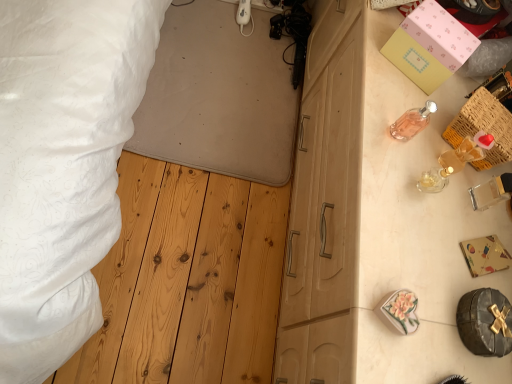
This screenshot has height=384, width=512. What do you see at coordinates (63, 165) in the screenshot?
I see `white textured bed at upper left` at bounding box center [63, 165].

Describe the element at coordinates (440, 34) in the screenshot. This screenshot has width=512, height=384. I see `pink matte box at upper right, the second box in the front-to-back sequence` at that location.

What is the approximate height of pink matte box at upper right, the 1th box when ordered from back to front?

5.49 inches.

At what (x,y) coordinates should I click in order to perform the action: click on gold foil gift box at right, which ranks as the second box in top-to-bottom order. Please return your answer as a coordinate pair (x, y). The height and width of the screenshot is (384, 512). Looking at the image, I should click on (485, 255).

Measure the distance between point (507,128) and camera.

The distance of point (507,128) from camera is 96.40 centimeters.

At what (x,y) coordinates should I click in order to perform the action: click on white textured bed at upper left. Please return your answer as a coordinate pair (x, y). The width and height of the screenshot is (512, 384). Looking at the image, I should click on (63, 165).

Can you see woven wood crate at upper right touching pink matte box at upper right, acting as the 1th box starting from the top?

No, woven wood crate at upper right is not in contact with pink matte box at upper right, acting as the 1th box starting from the top.

Is woven wood crate at upper right thinner than pink matte box at upper right, acting as the 1th box starting from the top?

Yes, woven wood crate at upper right is thinner than pink matte box at upper right, acting as the 1th box starting from the top.

Where is `box above the woven wood crate at upper right (from the image's perspective)`? box above the woven wood crate at upper right (from the image's perspective) is located at coordinates (440, 34).

Considering the positions of points (494, 137) and (438, 30), is point (494, 137) farther from camera compared to point (438, 30)?

No, it is in front of (438, 30).

From their relative heights in the image, would you say woven wood crate at upper right is taller or shorter than gold foil gift box at right, marked as the first box in a bottom-to-top arrangement?

woven wood crate at upper right is taller than gold foil gift box at right, marked as the first box in a bottom-to-top arrangement.

Is woven wood crate at upper right spatially inside gold foil gift box at right, which ranks as the second box in top-to-bottom order, or outside of it?

woven wood crate at upper right is not inside gold foil gift box at right, which ranks as the second box in top-to-bottom order, it's outside.

From the image's perspective, which one is positioned higher, woven wood crate at upper right or gold foil gift box at right, which ranks as the second box in top-to-bottom order?

From the image's view, woven wood crate at upper right is above.

Considering the relative positions of woven wood crate at upper right and gold foil gift box at right, positioned as the first box in front-to-back order, in the image provided, is woven wood crate at upper right to the right of gold foil gift box at right, positioned as the first box in front-to-back order, from the viewer's perspective?

Indeed, woven wood crate at upper right is positioned on the right side of gold foil gift box at right, positioned as the first box in front-to-back order.

From a real-world perspective, which object rests below the other?

white textured bed at upper left.

Which is correct: white textured bed at upper left is inside woven wood crate at upper right, or outside of it?

white textured bed at upper left is spatially situated outside woven wood crate at upper right.

From the image's perspective, is white textured bed at upper left under woven wood crate at upper right?

No.

Which of these two, white textured bed at upper left or woven wood crate at upper right, is thinner?

With smaller width is woven wood crate at upper right.

At what (x,y) coordinates should I click in order to perform the action: click on toiletry lying in front of the white textured bed at upper left. Please return your answer as a coordinate pair (x, y). Looking at the image, I should click on (412, 122).

Is white textured bed at upper left thinner than pink glass perfume at upper right?

In fact, white textured bed at upper left might be wider than pink glass perfume at upper right.

Looking at this image, how different are the orientations of white textured bed at upper left and pink glass perfume at upper right in degrees?

91.7 degrees.

From the picture: Is white textured bed at upper left in front of or behind pink glass perfume at upper right in the image?

In the image, white textured bed at upper left appears behind pink glass perfume at upper right.

Where is `box beneath the pink matte box at upper right, the 1th box when ordered from back to front (from a real-world perspective)`? The width and height of the screenshot is (512, 384). box beneath the pink matte box at upper right, the 1th box when ordered from back to front (from a real-world perspective) is located at coordinates (485, 255).

How much distance is there between pink matte box at upper right, the second box in the front-to-back sequence, and gold foil gift box at right, which ranks as the second box in top-to-bottom order?

pink matte box at upper right, the second box in the front-to-back sequence, is 18.49 inches away from gold foil gift box at right, which ranks as the second box in top-to-bottom order.

Between pink matte box at upper right, the second box in the front-to-back sequence, and gold foil gift box at right, the 2th box viewed from the back, which one has smaller width?

gold foil gift box at right, the 2th box viewed from the back.

How different are the orientations of pink glass perfume at upper right and gold foil gift box at right, marked as the first box in a bottom-to-top arrangement, in degrees?

19.7 degrees separate the facing orientations of pink glass perfume at upper right and gold foil gift box at right, marked as the first box in a bottom-to-top arrangement.

Is pink glass perfume at upper right located outside gold foil gift box at right, which ranks as the second box in top-to-bottom order?

Yes, pink glass perfume at upper right is not within gold foil gift box at right, which ranks as the second box in top-to-bottom order.

Is point (430, 109) behind point (479, 248)?

No, it is not.

Is white textured bed at upper left beside pink matte box at upper right, acting as the 1th box starting from the top?

There is a gap between white textured bed at upper left and pink matte box at upper right, acting as the 1th box starting from the top.

In terms of width, does white textured bed at upper left look wider or thinner when compared to pink matte box at upper right, the second box positioned from the bottom?

white textured bed at upper left is wider than pink matte box at upper right, the second box positioned from the bottom.

Does white textured bed at upper left have a lesser height compared to pink matte box at upper right, the 1th box when ordered from back to front?

Correct, white textured bed at upper left is not as tall as pink matte box at upper right, the 1th box when ordered from back to front.

Image resolution: width=512 pixels, height=384 pixels. Find the location of `crate on the left of pink matte box at upper right, acting as the 1th box starting from the top`. crate on the left of pink matte box at upper right, acting as the 1th box starting from the top is located at coordinates (483, 127).

At what (x,y) coordinates should I click in order to perform the action: click on box in front of the woven wood crate at upper right. Please return your answer as a coordinate pair (x, y). This screenshot has height=384, width=512. Looking at the image, I should click on (485, 255).

Based on their spatial positions, is white textured bed at upper left or woven wood crate at upper right further from pink matte box at upper right, the 1th box when ordered from back to front?

white textured bed at upper left is positioned further to the anchor pink matte box at upper right, the 1th box when ordered from back to front.

When comparing their distances from pink matte box at upper right, the 1th box when ordered from back to front, does gold foil gift box at right, positioned as the first box in front-to-back order, or woven wood crate at upper right seem further?

gold foil gift box at right, positioned as the first box in front-to-back order, lies further to pink matte box at upper right, the 1th box when ordered from back to front, than the other object.

Considering their positions, is white textured bed at upper left positioned further to woven wood crate at upper right than pink matte box at upper right, the second box positioned from the bottom?

The object further to woven wood crate at upper right is white textured bed at upper left.

From the image, which object appears to be farther from pink glass perfume at upper right, white textured bed at upper left or gold foil gift box at right, which ranks as the second box in top-to-bottom order?

white textured bed at upper left is positioned further to the anchor pink glass perfume at upper right.

Estimate the real-world distances between objects in this image. Which object is closer to gold foil gift box at right, marked as the first box in a bottom-to-top arrangement, pink glass perfume at upper right or pink matte box at upper right, the second box positioned from the bottom?

Among the two, pink glass perfume at upper right is located nearer to gold foil gift box at right, marked as the first box in a bottom-to-top arrangement.

From the image, which object appears to be nearer to white textured bed at upper left, woven wood crate at upper right or gold foil gift box at right, which ranks as the second box in top-to-bottom order?

woven wood crate at upper right.

Estimate the real-world distances between objects in this image. Which object is closer to pink matte box at upper right, the second box in the front-to-back sequence, woven wood crate at upper right or white textured bed at upper left?

The object closer to pink matte box at upper right, the second box in the front-to-back sequence, is woven wood crate at upper right.

Looking at the image, which one is located further to gold foil gift box at right, which ranks as the second box in top-to-bottom order, pink matte box at upper right, the second box positioned from the bottom, or pink glass perfume at upper right?

Based on the image, pink matte box at upper right, the second box positioned from the bottom, appears to be further to gold foil gift box at right, which ranks as the second box in top-to-bottom order.

The height and width of the screenshot is (384, 512). Identify the location of toiletry between white textured bed at upper left and pink matte box at upper right, the 1th box when ordered from back to front, from left to right. (412, 122).

At what (x,y) coordinates should I click in order to perform the action: click on crate between pink glass perfume at upper right and gold foil gift box at right, marked as the first box in a bottom-to-top arrangement, vertically. Please return your answer as a coordinate pair (x, y). This screenshot has height=384, width=512. Looking at the image, I should click on (483, 127).

Identify the location of box between white textured bed at upper left and woven wood crate at upper right in the horizontal direction. The image size is (512, 384). (485, 255).

Locate an element on the screen. This screenshot has height=384, width=512. toiletry between white textured bed at upper left and gold foil gift box at right, marked as the first box in a bottom-to-top arrangement, from left to right is located at coordinates (412, 122).